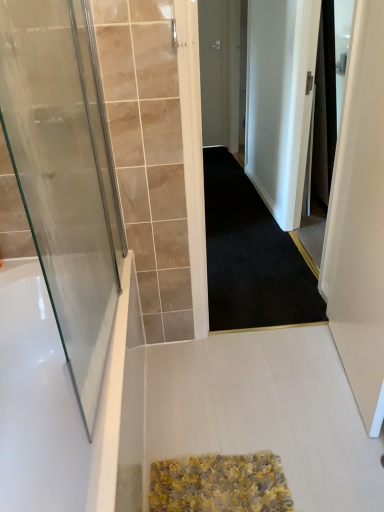
Question: Is transparent glass door at left, the 2th door in the right-to-left sequence, at the left side of white glossy bathtub at left?

Choices:
 (A) yes
 (B) no

Answer: (B)

Question: Is transparent glass door at left, acting as the 2th door starting from the top, taller than white glossy bathtub at left?

Choices:
 (A) no
 (B) yes

Answer: (B)

Question: Is the position of transparent glass door at left, which is counted as the 1th door, starting from the bottom, less distant than that of white glossy bathtub at left?

Choices:
 (A) no
 (B) yes

Answer: (B)

Question: Is transparent glass door at left, acting as the 2th door starting from the top, further to the viewer compared to white glossy bathtub at left?

Choices:
 (A) yes
 (B) no

Answer: (B)

Question: Are transparent glass door at left, acting as the 2th door starting from the top, and white glossy bathtub at left far apart?

Choices:
 (A) yes
 (B) no

Answer: (B)

Question: Does transparent glass door at left, marked as the first door in a left-to-right arrangement, have a smaller size compared to white glossy bathtub at left?

Choices:
 (A) no
 (B) yes

Answer: (B)

Question: From the image's perspective, is white glossy bathtub at left above white matte screen door at right?

Choices:
 (A) no
 (B) yes

Answer: (A)

Question: Is white glossy bathtub at left oriented towards white matte screen door at right?

Choices:
 (A) yes
 (B) no

Answer: (A)

Question: Is white glossy bathtub at left outside white matte screen door at right?

Choices:
 (A) no
 (B) yes

Answer: (B)

Question: Is the depth of white glossy bathtub at left greater than that of white matte screen door at right?

Choices:
 (A) no
 (B) yes

Answer: (B)

Question: Does white glossy bathtub at left have a greater width compared to white matte screen door at right?

Choices:
 (A) yes
 (B) no

Answer: (A)

Question: Is white glossy bathtub at left in contact with white matte screen door at right?

Choices:
 (A) no
 (B) yes

Answer: (A)

Question: Is white matte screen door at right next to black carpet at center?

Choices:
 (A) yes
 (B) no

Answer: (B)